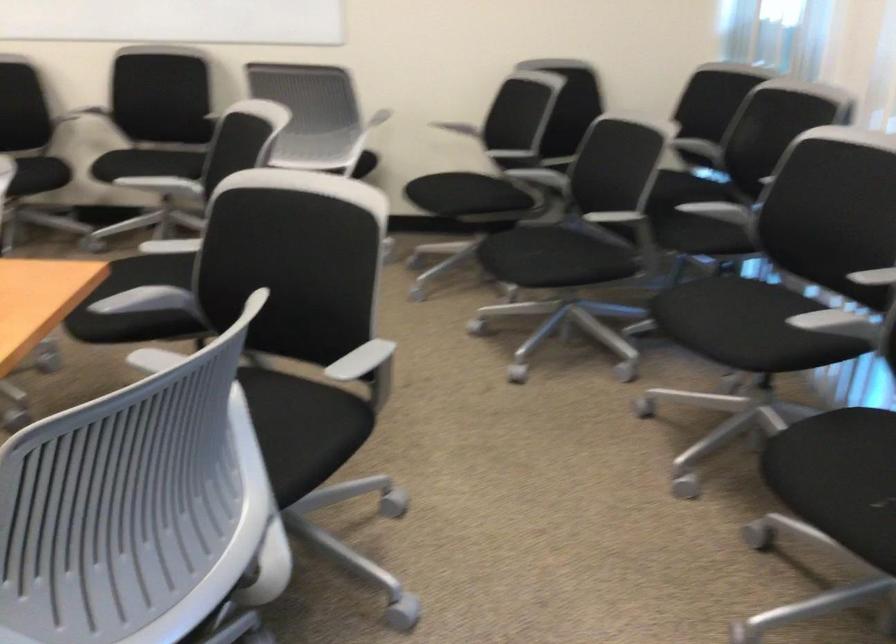
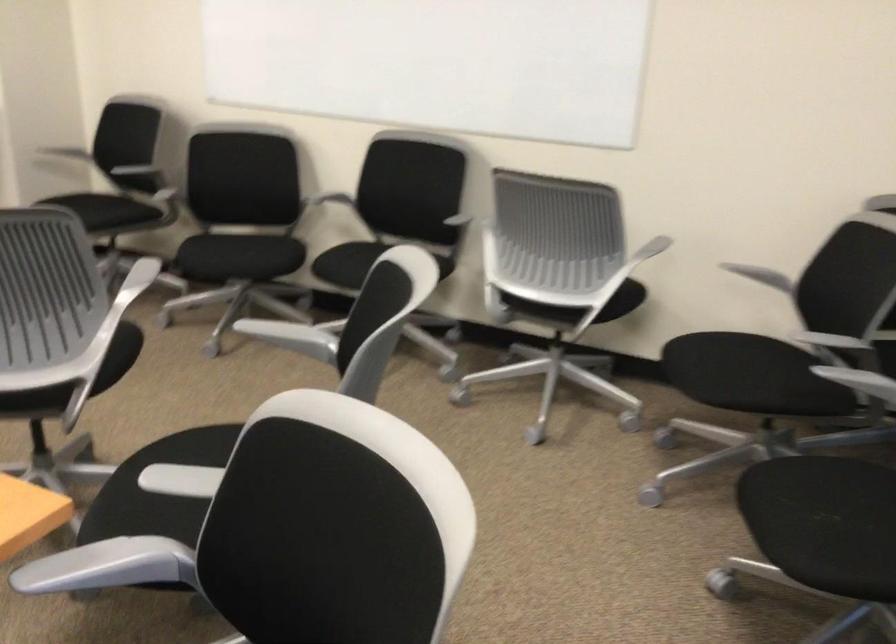
Locate, in the second image, the point that corresponds to (452,194) in the first image.

(721, 377)